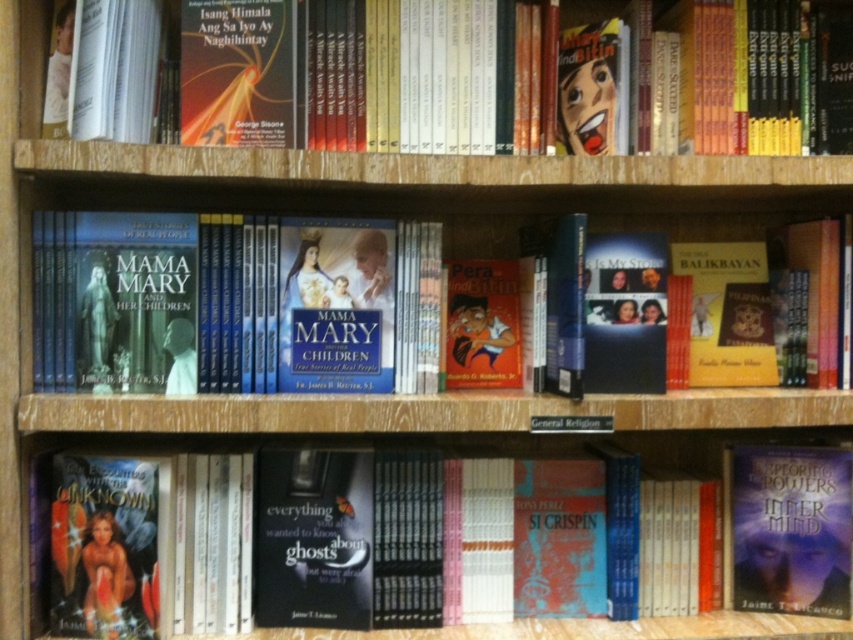
Between point (364, 244) and point (666, 630), which one is positioned behind?

Point (666, 630)

Who is shorter, matte hardcover book at center or hardcover book at lower left?

hardcover book at lower left

The width and height of the screenshot is (853, 640). What do you see at coordinates (335, 305) in the screenshot?
I see `matte hardcover book at center` at bounding box center [335, 305].

The width and height of the screenshot is (853, 640). What are the coordinates of `matte hardcover book at center` in the screenshot? It's located at (335, 305).

Which is more to the right, hardcover book at center or hardcover book at upper center?

hardcover book at upper center is more to the right.

Which is behind, point (289, 360) or point (247, 72)?

The point (289, 360) is more distant.

You are a GUI agent. You are given a task and a screenshot of the screen. Output one action in this format:
    pyautogui.click(x=<x>, y=<y>)
    Task: Click on the hardcover book at center
    The height and width of the screenshot is (640, 853).
    Given the screenshot: What is the action you would take?
    pyautogui.click(x=154, y=304)

Is hardcover book at upper center further to the viewer compared to matte hardcover book at center?

No, hardcover book at upper center is in front of matte hardcover book at center.

What do you see at coordinates (763, 77) in the screenshot?
I see `hardcover book at upper center` at bounding box center [763, 77].

This screenshot has height=640, width=853. I want to click on hardcover book at upper center, so click(x=763, y=77).